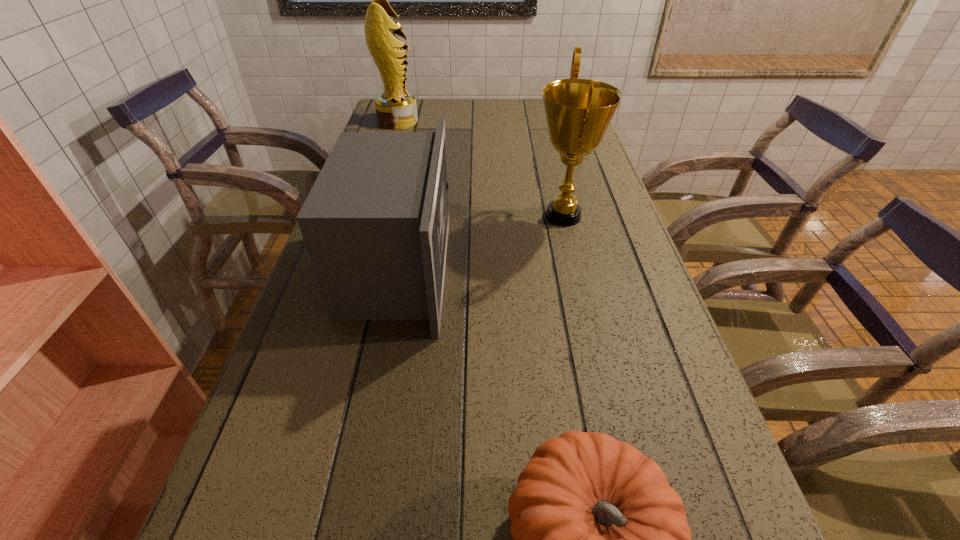
Identify the location of award that is at the left edge. This screenshot has height=540, width=960. (396, 108).

You are a GUI agent. You are given a task and a screenshot of the screen. Output one action in this format:
    pyautogui.click(x=<x>, y=<y>)
    Task: Click on the microwave oven positioned at the left edge
    The height and width of the screenshot is (540, 960).
    Given the screenshot: What is the action you would take?
    [x=375, y=224]

Find the location of `object positioned at the right edge`. object positioned at the right edge is located at coordinates point(578,111).

At what (x,y) coordinates should I click in order to perform the action: click on object that is at the far left corner. Please return your answer as a coordinate pair (x, y). The image size is (960, 540). Looking at the image, I should click on (396, 108).

The width and height of the screenshot is (960, 540). I want to click on free space at the far edge, so click(469, 120).

This screenshot has width=960, height=540. In the image, there is a desktop. Identify the location of free space at the left edge. (248, 511).

The image size is (960, 540). What are the coordinates of `vacant area at the right edge of the desktop` in the screenshot? It's located at (558, 174).

Identify the location of vacant space at the far left corner. (417, 124).

Identify the location of vacant area between the right award and the farthest object. The image size is (960, 540). pos(481,168).

Locate an element on the screen. vacant area that lies between the second shortest object and the right award is located at coordinates (481, 242).